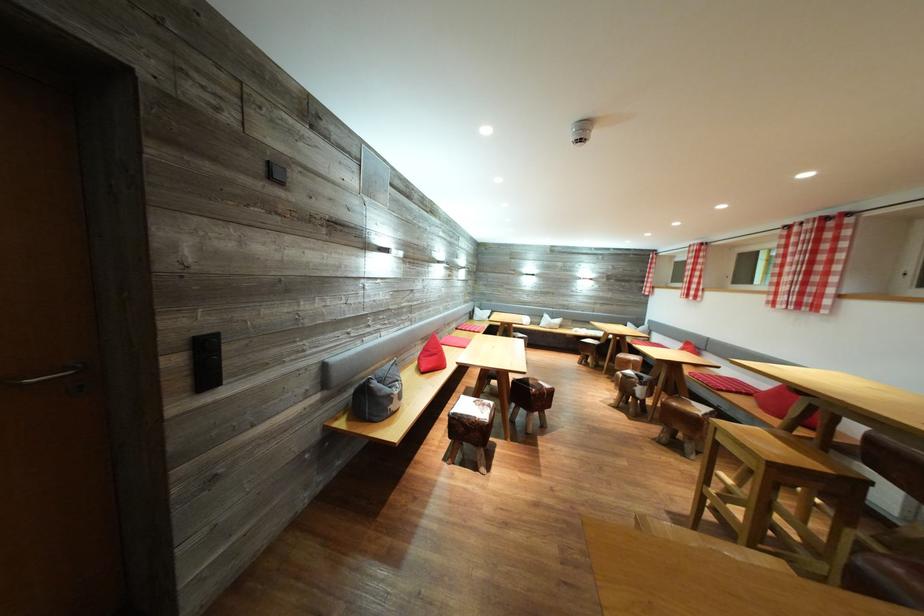
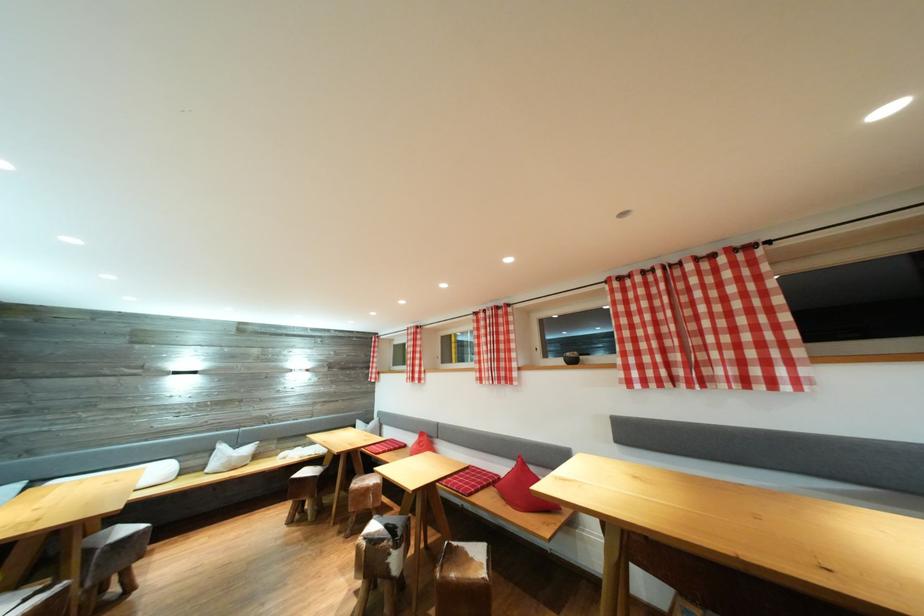
Find the pixel in the second image that matches point 553,322 in the first image.

(228, 453)